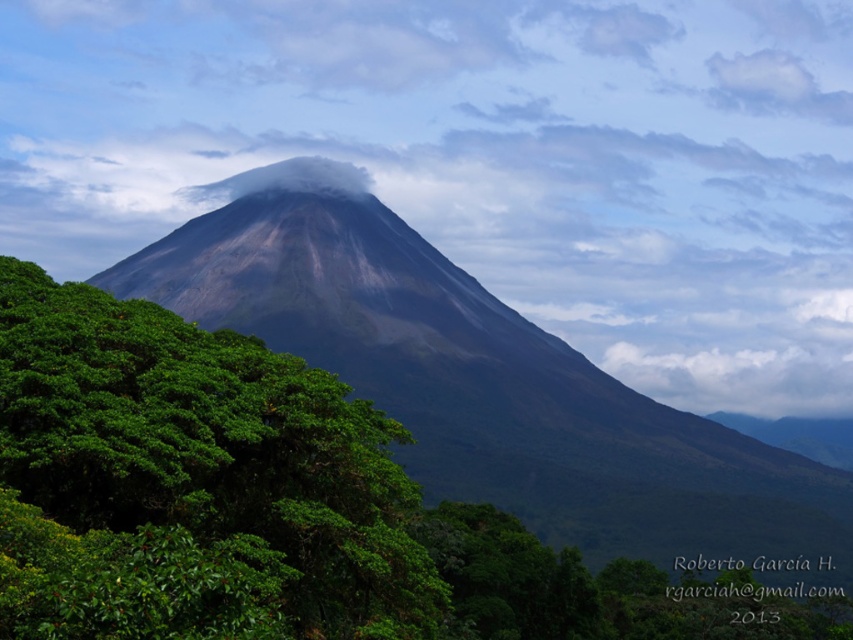
Question: Which object is positioned closest to the volcanic rock mountain at center?

Choices:
 (A) green leafy tree at left
 (B) white fluffy cloud at upper center

Answer: (A)

Question: Observing the image, what is the correct spatial positioning of white fluffy cloud at upper center in reference to green leafy tree at left?

Choices:
 (A) right
 (B) left

Answer: (A)

Question: Which of the following is the farthest from the observer?

Choices:
 (A) (746, 300)
 (B) (686, 497)
 (C) (364, 593)

Answer: (A)

Question: Considering the relative positions of white fluffy cloud at upper center and green leafy tree at left in the image provided, where is white fluffy cloud at upper center located with respect to green leafy tree at left?

Choices:
 (A) left
 (B) right

Answer: (B)

Question: Based on their relative distances, which object is nearer to the green leafy tree at left?

Choices:
 (A) white fluffy cloud at upper center
 (B) volcanic rock mountain at center

Answer: (B)

Question: Does white fluffy cloud at upper center come in front of volcanic rock mountain at center?

Choices:
 (A) no
 (B) yes

Answer: (A)